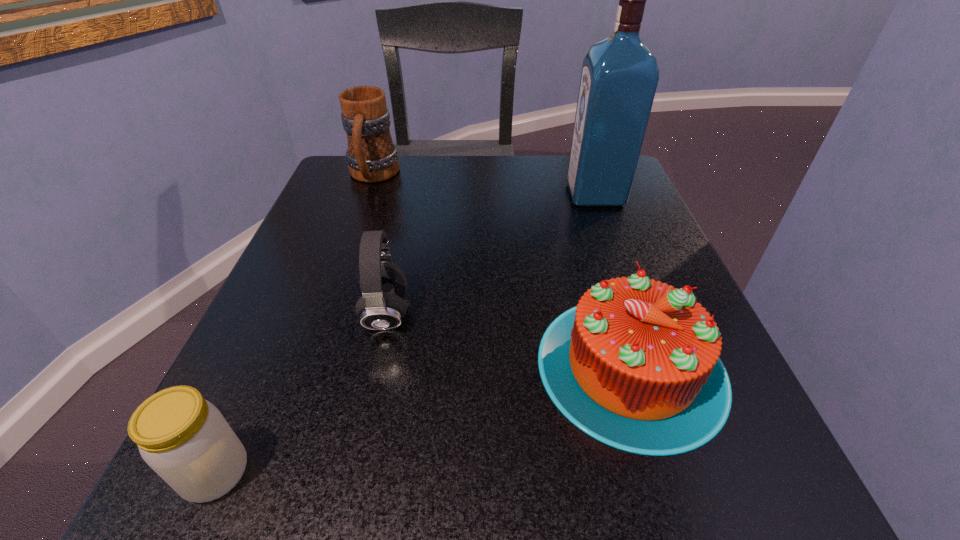
What are the coordinates of `free region at the near right corner` in the screenshot? It's located at (738, 461).

Locate an element on the screen. This screenshot has height=540, width=960. free point between the cake and the headset is located at coordinates (509, 340).

This screenshot has height=540, width=960. In order to click on free area in between the second tallest object and the cake in this screenshot , I will do `click(502, 271)`.

You are a GUI agent. You are given a task and a screenshot of the screen. Output one action in this format:
    pyautogui.click(x=<x>, y=<y>)
    Task: Click on the free point between the mug and the liquor
    The width and height of the screenshot is (960, 540).
    Given the screenshot: What is the action you would take?
    pyautogui.click(x=484, y=185)

I want to click on free space between the cake and the headset, so click(x=509, y=340).

This screenshot has width=960, height=540. Identify the location of empty location between the cake and the mug. (502, 271).

At what (x,y) coordinates should I click in order to perform the action: click on free area in between the second tallest object and the cake. Please return your answer as a coordinate pair (x, y). Looking at the image, I should click on (502, 271).

You are a GUI agent. You are given a task and a screenshot of the screen. Output one action in this format:
    pyautogui.click(x=<x>, y=<y>)
    Task: Click on the empty location between the tallest object and the third object from right to left
    This screenshot has height=540, width=960.
    Given the screenshot: What is the action you would take?
    pyautogui.click(x=491, y=254)

Locate an element on the screen. the closest object relative to the tallest object is located at coordinates tap(635, 365).

Select which object appears as the closest to the cake. Please provide its 2D coordinates. Your answer should be formatted as a tuple, i.e. [(x, y)], where the tuple contains the x and y coordinates of a point satisfying the conditions above.

[(383, 285)]